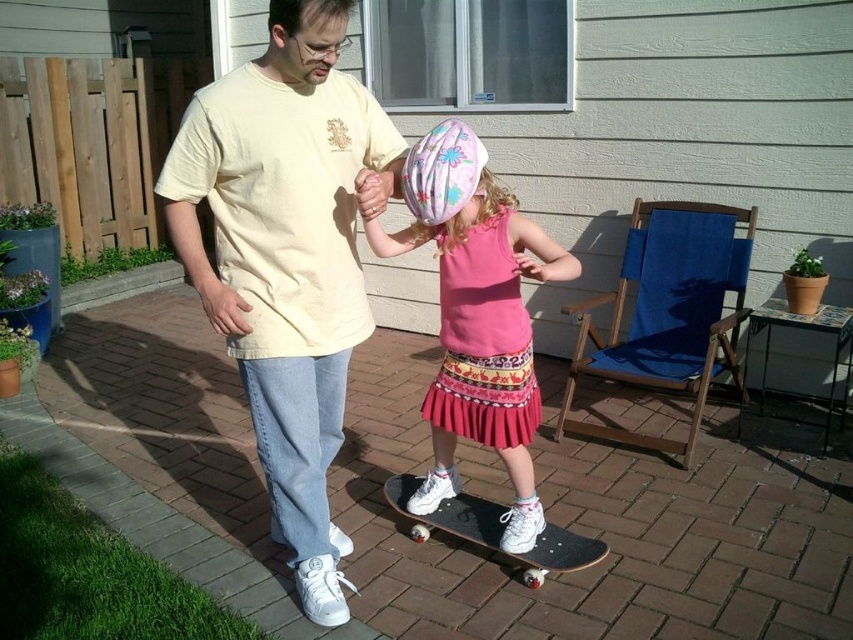
Question: Among these points, which one is farthest from the camera?

Choices:
 (A) (537, 556)
 (B) (512, 460)

Answer: (B)

Question: Which point is closer to the camera?

Choices:
 (A) black smooth skateboard at center
 (B) matte yellow t-shirt at center

Answer: (B)

Question: Among these objects, which one is farthest from the camera?

Choices:
 (A) pink fabric skirt at center
 (B) black smooth skateboard at center
 (C) matte yellow t-shirt at center

Answer: (B)

Question: Can you confirm if pink fabric skirt at center is bigger than black smooth skateboard at center?

Choices:
 (A) no
 (B) yes

Answer: (B)

Question: Is the position of matte yellow t-shirt at center less distant than that of black smooth skateboard at center?

Choices:
 (A) no
 (B) yes

Answer: (B)

Question: Can you confirm if matte yellow t-shirt at center is positioned above black smooth skateboard at center?

Choices:
 (A) no
 (B) yes

Answer: (B)